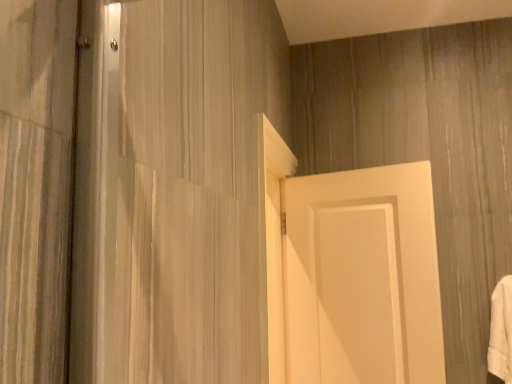
The width and height of the screenshot is (512, 384). I want to click on white soft towel at right, so click(501, 331).

The width and height of the screenshot is (512, 384). Describe the element at coordinates (501, 331) in the screenshot. I see `white soft towel at right` at that location.

From the picture: Measure the distance between point [495,350] and camera.

1.61 meters.

Locate an element on the screen. The image size is (512, 384). white matte door at center is located at coordinates (362, 277).

This screenshot has width=512, height=384. What do you see at coordinates (362, 277) in the screenshot? I see `white matte door at center` at bounding box center [362, 277].

Where is `white soft towel at right`? white soft towel at right is located at coordinates (501, 331).

Is white soft towel at right to the right of white matte door at center from the viewer's perspective?

Yes, white soft towel at right is to the right of white matte door at center.

Considering the relative positions of white soft towel at right and white matte door at center in the image provided, is white soft towel at right behind white matte door at center?

Yes, white soft towel at right is further from the viewer.

Which is behind, point (501, 308) or point (431, 187)?

Positioned behind is point (431, 187).

From the image's perspective, is white soft towel at right positioned above or below white matte door at center?

From the image's perspective, white soft towel at right appears below white matte door at center.

From a real-world perspective, relative to white matte door at center, is white soft towel at right vertically above or below?

From a real-world perspective, white soft towel at right is physically below white matte door at center.

Consider the image. Considering the sizes of objects white soft towel at right and white matte door at center in the image provided, who is wider, white soft towel at right or white matte door at center?

white soft towel at right.

Does white soft towel at right have a greater height compared to white matte door at center?

No.

Considering the relative sizes of white soft towel at right and white matte door at center in the image provided, is white soft towel at right smaller than white matte door at center?

Yes, white soft towel at right is smaller than white matte door at center.

Can we say white soft towel at right lies outside white matte door at center?

Yes, white soft towel at right is outside of white matte door at center.

Would you consider white soft towel at right to be distant from white matte door at center?

That's not correct — white soft towel at right is a little close to white matte door at center.

Is white soft towel at right aimed at white matte door at center?

No, white soft towel at right is not turned towards white matte door at center.

How different are the orientations of white soft towel at right and white matte door at center in degrees?

The angle between the facing direction of white soft towel at right and the facing direction of white matte door at center is 10.8 degrees.

The image size is (512, 384). Identify the location of bath towel behind the white matte door at center. tap(501, 331).

Considering the positions of objects white matte door at center and white soft towel at right in the image provided, who is more to the right, white matte door at center or white soft towel at right?

From the viewer's perspective, white soft towel at right appears more on the right side.

Is white matte door at center closer to the viewer compared to white soft towel at right?

Yes, white matte door at center is closer to the camera.

Does point (296, 340) come farther from viewer compared to point (497, 350)?

Yes, it is.

From the image's perspective, is white matte door at center positioned above or below white soft towel at right?

From the image's perspective, white matte door at center appears above white soft towel at right.

From a real-world perspective, is white matte door at center physically below white soft towel at right?

No, from a real-world perspective, white matte door at center is not below white soft towel at right.

Considering the relative sizes of white matte door at center and white soft towel at right in the image provided, is white matte door at center wider than white soft towel at right?

Incorrect, the width of white matte door at center does not surpass that of white soft towel at right.

Which of these two, white matte door at center or white soft towel at right, stands taller?

Standing taller between the two is white matte door at center.

Who is smaller, white matte door at center or white soft towel at right?

With smaller size is white soft towel at right.

Is white matte door at center completely or partially outside of white soft towel at right?

white matte door at center is positioned outside white soft towel at right.

Is white matte door at center beside white soft towel at right?

No, white matte door at center is not with white soft towel at right.

Could you tell me if white matte door at center is facing white soft towel at right?

No, white matte door at center is not facing towards white soft towel at right.

Image resolution: width=512 pixels, height=384 pixels. What are the coordinates of `bath towel below the white matte door at center (from a real-world perspective)` in the screenshot? It's located at (501, 331).

This screenshot has height=384, width=512. Find the location of `bath towel below the white matte door at center (from the image's perspective)`. bath towel below the white matte door at center (from the image's perspective) is located at coordinates (501, 331).

Find the location of `door in front of the white soft towel at right`. door in front of the white soft towel at right is located at coordinates (362, 277).